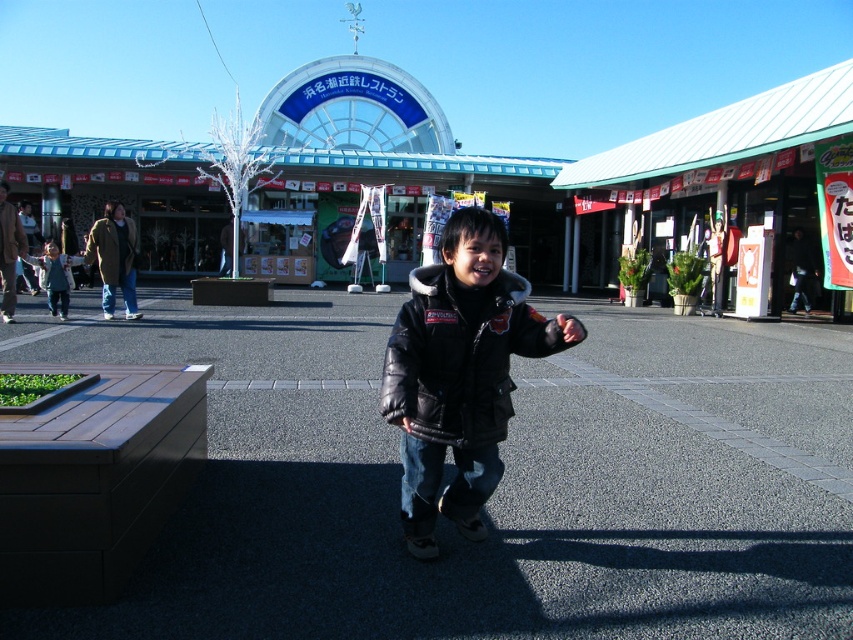
You are a photographer standing at the edge of the scene. You want to take a photo of the black leather jacket at center without the dark gray asphalt at center appearing in the foreground. Is this possible given their positions?

The dark gray asphalt at center is closer to the viewer than the black leather jacket at center, so it would block the view of the black leather jacket at center. Therefore, it is not possible to take a photo of the black leather jacket at center without the dark gray asphalt at center appearing in the foreground.

You are a delivery person trying to park your bike. You see the dark gray asphalt at center and the black leather jacket at center. Which surface is big enough to park your bike on?

The dark gray asphalt at center has a larger size compared to the black leather jacket at center, so you can park your bike on the dark gray asphalt at center.

You are a delivery person carrying a box that is 5 meters long. You are standing on the dark gray asphalt at center and need to place the box so that it extends towards the black leather jacket at center. Is the distance between them sufficient for the box to fit entirely without overlapping either the asphalt or the jacket?

The dark gray asphalt at center and black leather jacket at center are 4.60 meters apart. Since the box is 5 meters long, which is longer than the distance between them, the box cannot fit entirely without overlapping either the asphalt or the jacket.